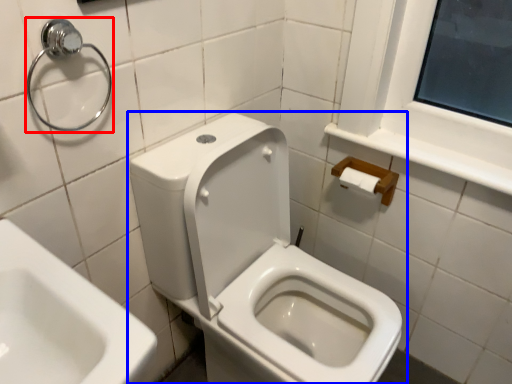
Question: Which point is further to the camera, shower (highlighted by a red box) or toilet (highlighted by a blue box)?

Choices:
 (A) shower
 (B) toilet

Answer: (A)